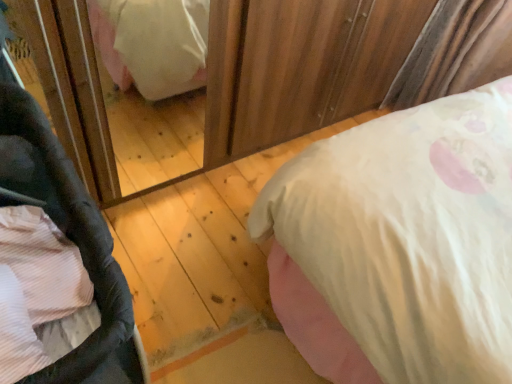
Question: Considering the relative sizes of black fabric baby carriage at lower left and pink satin bed at lower left in the image provided, is black fabric baby carriage at lower left shorter than pink satin bed at lower left?

Choices:
 (A) yes
 (B) no

Answer: (B)

Question: Is pink satin bed at lower left surrounded by black fabric baby carriage at lower left?

Choices:
 (A) yes
 (B) no

Answer: (B)

Question: From the image's perspective, is black fabric baby carriage at lower left under pink satin bed at lower left?

Choices:
 (A) yes
 (B) no

Answer: (A)

Question: From a real-world perspective, is black fabric baby carriage at lower left located higher than pink satin bed at lower left?

Choices:
 (A) yes
 (B) no

Answer: (A)

Question: Does black fabric baby carriage at lower left have a lesser width compared to pink satin bed at lower left?

Choices:
 (A) no
 (B) yes

Answer: (B)

Question: Is the position of black fabric baby carriage at lower left more distant than that of pink satin bed at lower left?

Choices:
 (A) yes
 (B) no

Answer: (B)

Question: Would you say pink satin bed at lower left is outside black fabric baby carriage at lower left?

Choices:
 (A) yes
 (B) no

Answer: (A)

Question: Can you confirm if pink satin bed at lower left is thinner than black fabric baby carriage at lower left?

Choices:
 (A) no
 (B) yes

Answer: (A)

Question: From a real-world perspective, is pink satin bed at lower left beneath black fabric baby carriage at lower left?

Choices:
 (A) yes
 (B) no

Answer: (A)

Question: From the image's perspective, does pink satin bed at lower left appear higher than black fabric baby carriage at lower left?

Choices:
 (A) no
 (B) yes

Answer: (B)

Question: Does pink satin bed at lower left appear on the left side of black fabric baby carriage at lower left?

Choices:
 (A) yes
 (B) no

Answer: (B)

Question: Would you say black fabric baby carriage at lower left is part of pink satin bed at lower left's contents?

Choices:
 (A) yes
 (B) no

Answer: (B)

Question: In terms of size, does black fabric baby carriage at lower left appear bigger or smaller than pink satin bed at lower left?

Choices:
 (A) big
 (B) small

Answer: (A)